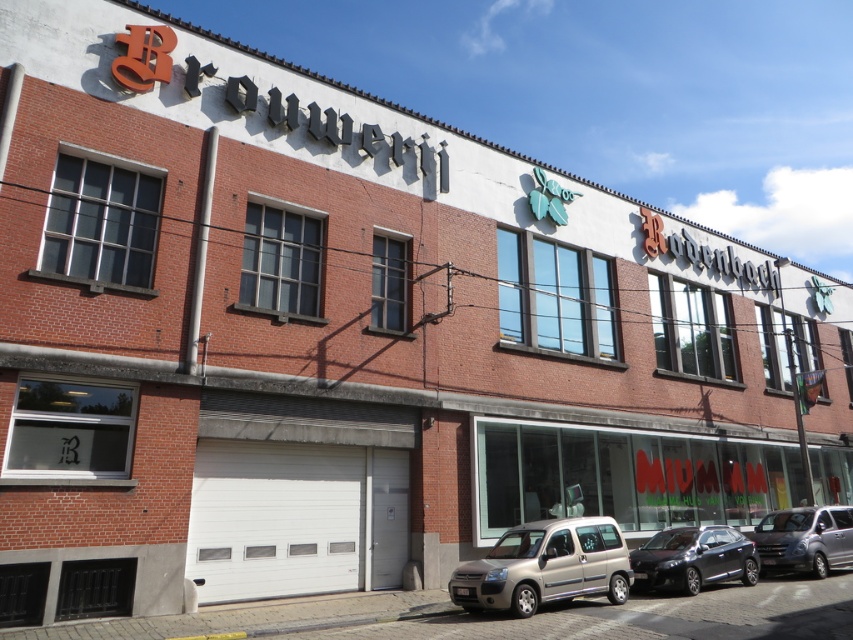
Which is more to the left, silver metallic van at center or satin black car at lower center?

silver metallic van at center is more to the left.

Does silver metallic van at center have a smaller size compared to satin black car at lower center?

No, silver metallic van at center is not smaller than satin black car at lower center.

Is point (560, 572) farther from viewer compared to point (735, 554)?

No, (560, 572) is closer to viewer.

The height and width of the screenshot is (640, 853). Find the location of `silver metallic van at center`. silver metallic van at center is located at coordinates (544, 566).

From the picture: Measure the distance between satin black car at lower center and camera.

A distance of 37.50 feet exists between satin black car at lower center and camera.

Which is below, satin black car at lower center or metallic silver van at lower right?

metallic silver van at lower right

The width and height of the screenshot is (853, 640). Find the location of `satin black car at lower center`. satin black car at lower center is located at coordinates (693, 557).

Identify the location of satin black car at lower center. Image resolution: width=853 pixels, height=640 pixels. (693, 557).

Is point (524, 616) less distant than point (842, 529)?

That is True.

Does silver metallic van at center have a greater height compared to metallic silver van at lower right?

Yes, silver metallic van at center is taller than metallic silver van at lower right.

Is point (527, 563) positioned before point (799, 557)?

Yes.

Where is `silver metallic van at center`? This screenshot has width=853, height=640. silver metallic van at center is located at coordinates (544, 566).